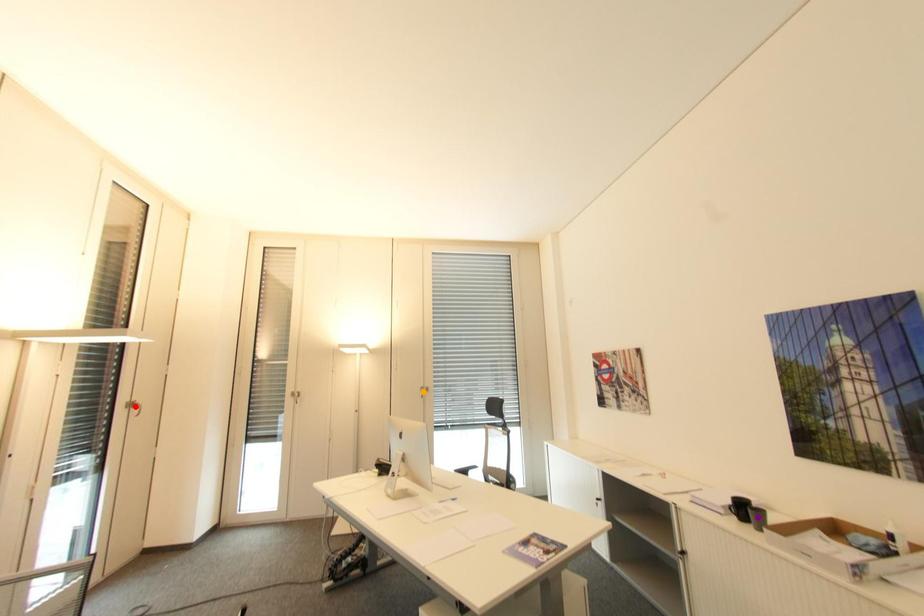
Order these from nearest to farthest:
orange point, red point, purple point

purple point
red point
orange point